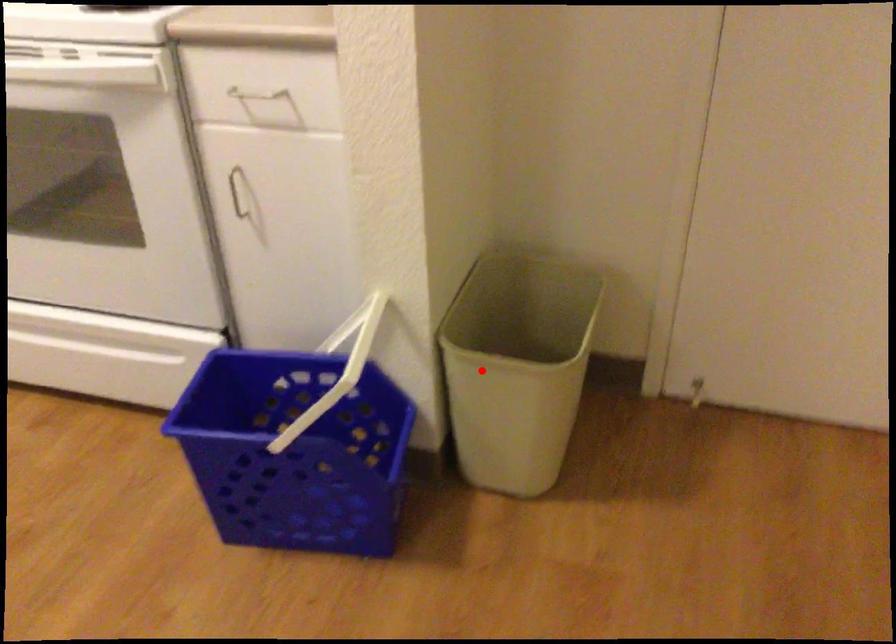
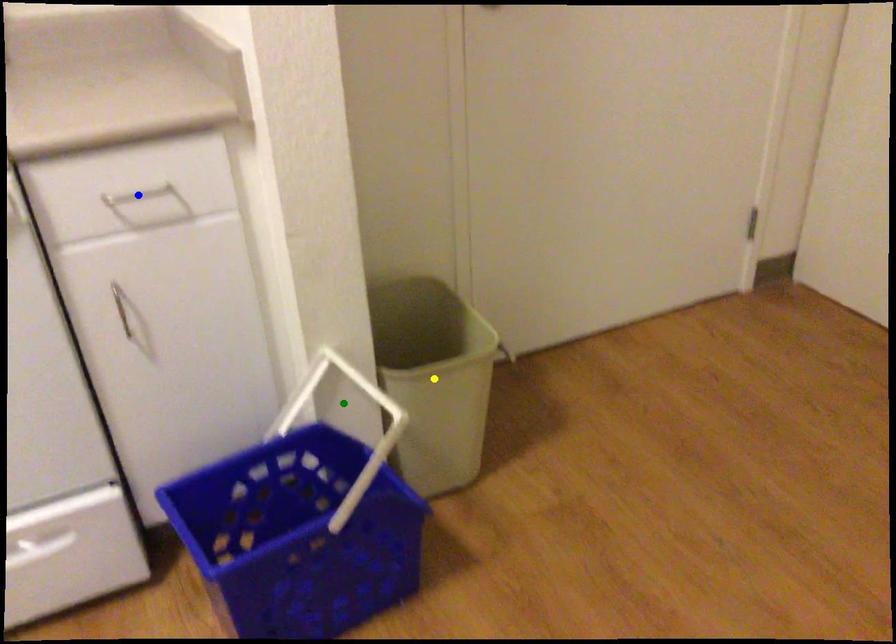
Question: I am providing you with two images of the same scene from different viewpoints. A red point is marked on the first image. You are given multiple points on the second image. Which mark in image 2 goes with the point in image 1?

Choices:
 (A) blue point
 (B) yellow point
 (C) green point

Answer: (B)